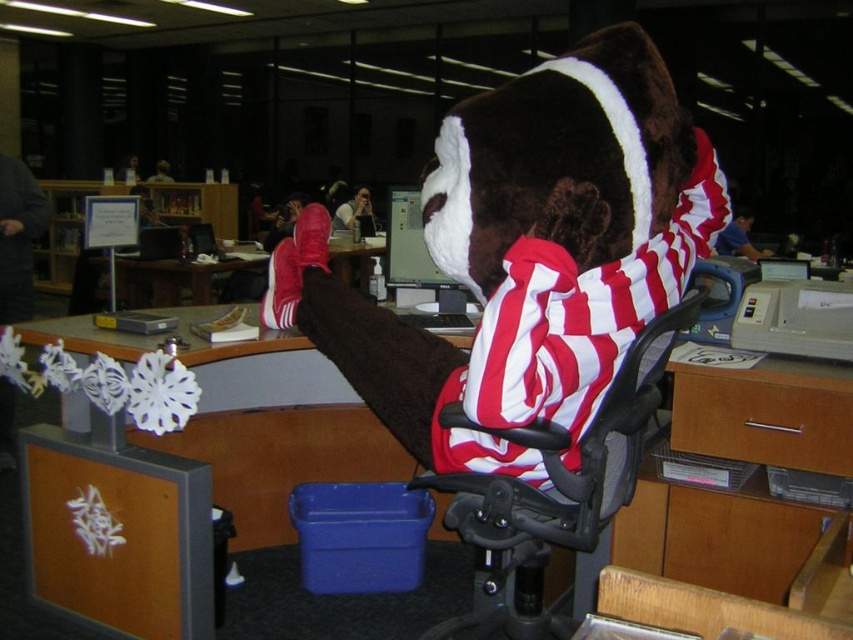
You are a drone operator trying to capture a photo of the mascot costume from above. You need to position your drone between the two points, point (473, 536) and point (733, 604). Which point should the drone be closer to in order to ensure it stays above the mascot costume?

The drone should be closer to point (473, 536) because it is closer to the camera than point (733, 604), so positioning the drone there would keep it above the mascot costume.

You are an office worker who needs to choose between the black mesh chair at center and the black mesh swivel chair at center for a meeting. Which chair should you choose if you want one that is wider?

The black mesh chair at center is wider than the black mesh swivel chair at center, so you should choose the black mesh chair at center for the meeting.